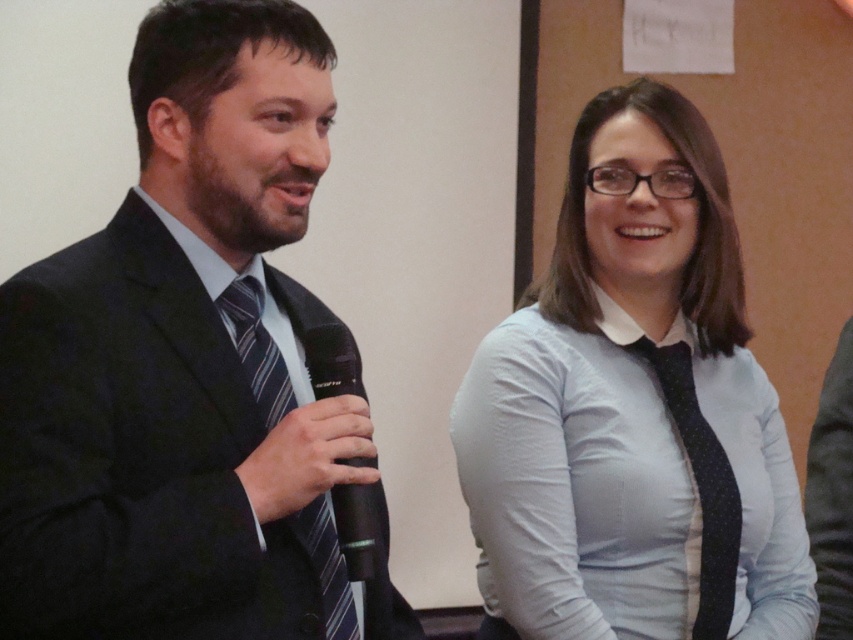
You are an event organizer who needs to ensure that all participants have matching attire. You notice the light blue shirt at center and the black dotted tie at center. Which item has a greater width?

The light blue shirt at center has a greater width than the black dotted tie at center, as stated in the description that the light blue shirt at center surpasses the black dotted tie at center in width.